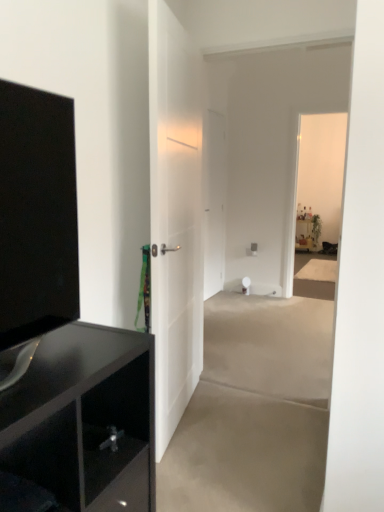
The width and height of the screenshot is (384, 512). What are the coordinates of `vacant space to the right of white glossy door at center, which ranks as the 2th door in front-to-back order` in the screenshot? It's located at (241, 295).